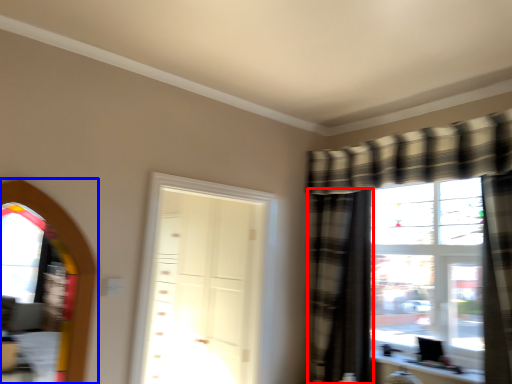
Question: Which point is closer to the camera, curtain (highlighted by a red box) or window screen (highlighted by a blue box)?

Choices:
 (A) curtain
 (B) window screen

Answer: (B)